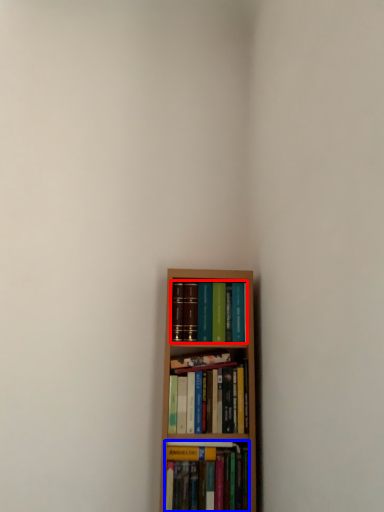
Question: Which point is further to the camera, book (highlighted by a red box) or book (highlighted by a blue box)?

Choices:
 (A) book
 (B) book

Answer: (A)